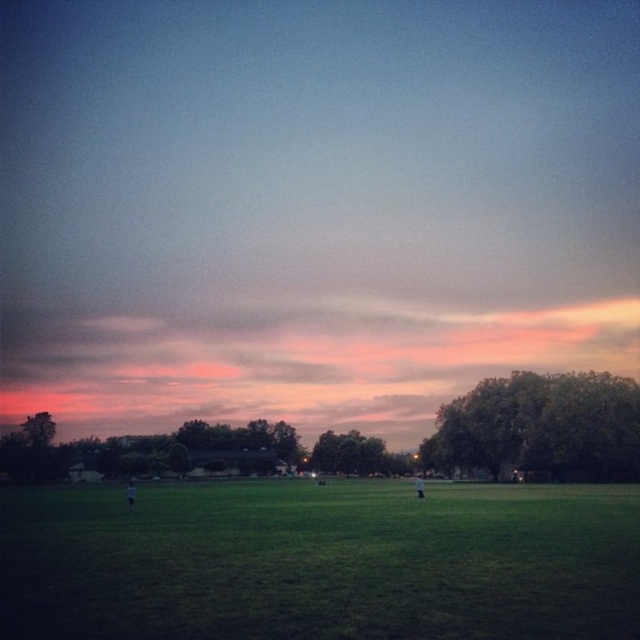
The image size is (640, 640). Describe the element at coordinates (321, 563) in the screenshot. I see `green grass at center` at that location.

In the scene shown: Who is taller, green grass at center or white cotton shirt at center?

With more height is white cotton shirt at center.

Between point (227, 490) and point (420, 490), which one is positioned behind?

The point (227, 490) is behind.

Where is `green grass at center`? The width and height of the screenshot is (640, 640). green grass at center is located at coordinates (321, 563).

Does green grass at center come behind dark gray fabric at center?

No, it is in front of dark gray fabric at center.

Does green grass at center have a greater height compared to dark gray fabric at center?

Incorrect, green grass at center's height is not larger of dark gray fabric at center's.

Between point (195, 520) and point (131, 481), which one is positioned in front?

Point (195, 520) is more forward.

Find the location of `green grass at center`. green grass at center is located at coordinates (321, 563).

Is dark gray fabric at center to the right of white cotton shirt at center from the viewer's perspective?

In fact, dark gray fabric at center is to the left of white cotton shirt at center.

Looking at this image, who is positioned more to the right, dark gray fabric at center or white cotton shirt at center?

From the viewer's perspective, white cotton shirt at center appears more on the right side.

Between point (132, 497) and point (419, 490), which one is positioned in front?

Point (132, 497)

I want to click on dark gray fabric at center, so click(129, 493).